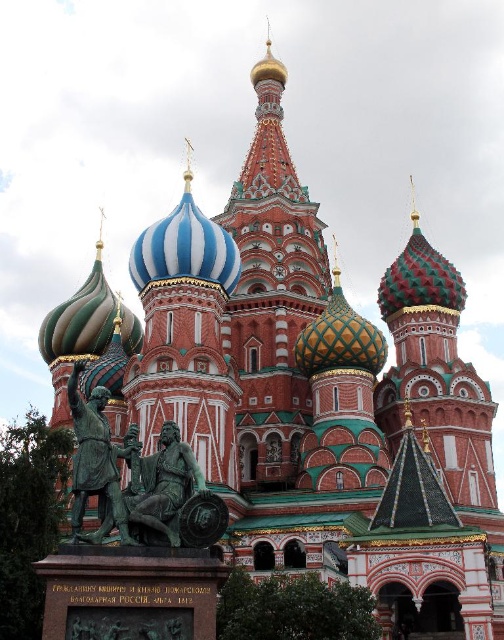
Question: Which of the following is the farthest from the observer?

Choices:
 (A) green patinated bronze statue at lower left
 (B) blue striped dome at center
 (C) bronze statue at lower left

Answer: (B)

Question: Considering the real-world distances, which object is closest to the green patinated bronze statue at lower left?

Choices:
 (A) bronze statue at lower left
 (B) blue striped dome at center

Answer: (A)

Question: Which object is closer to the camera taking this photo?

Choices:
 (A) blue striped dome at center
 (B) green patinated bronze statue at lower left
 (C) bronze statue at lower left

Answer: (B)

Question: Can you confirm if green patinated bronze statue at lower left is thinner than bronze statue at lower left?

Choices:
 (A) no
 (B) yes

Answer: (B)

Question: Can you confirm if blue striped dome at center is positioned above bronze statue at lower left?

Choices:
 (A) yes
 (B) no

Answer: (A)

Question: Considering the relative positions of green patinated bronze statue at lower left and bronze statue at lower left in the image provided, where is green patinated bronze statue at lower left located with respect to bronze statue at lower left?

Choices:
 (A) left
 (B) right

Answer: (B)